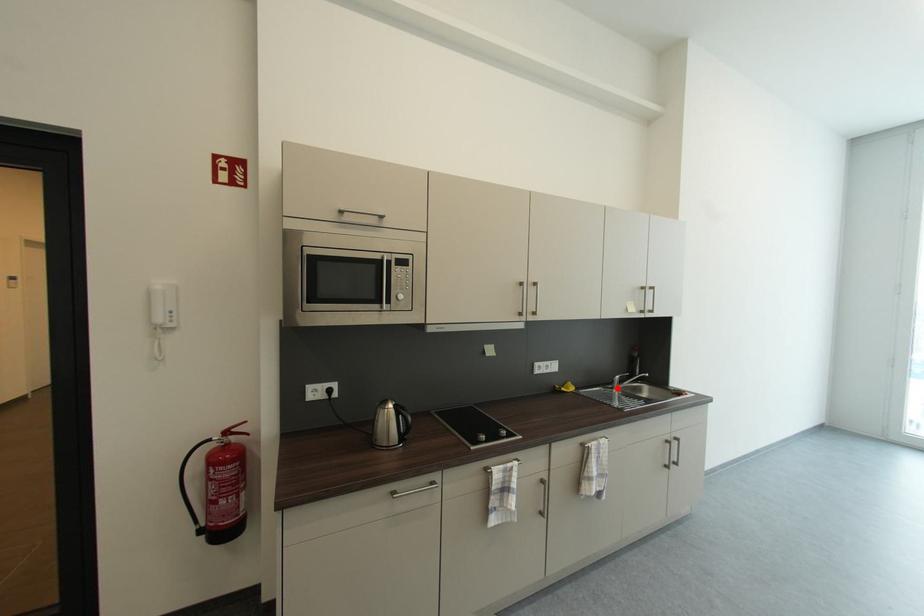
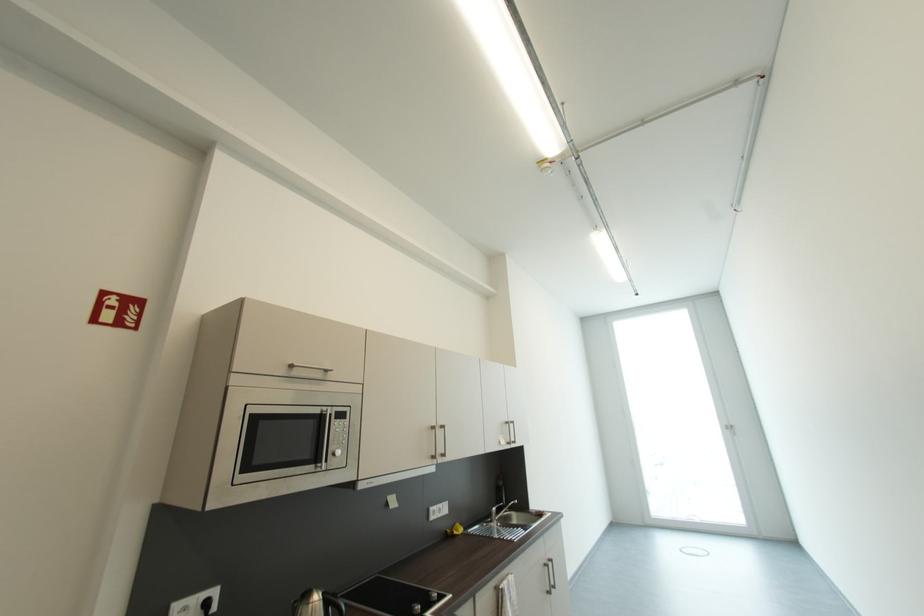
The point at the highlighted location is marked in the first image. Where is the corresponding point in the second image?

(495, 522)